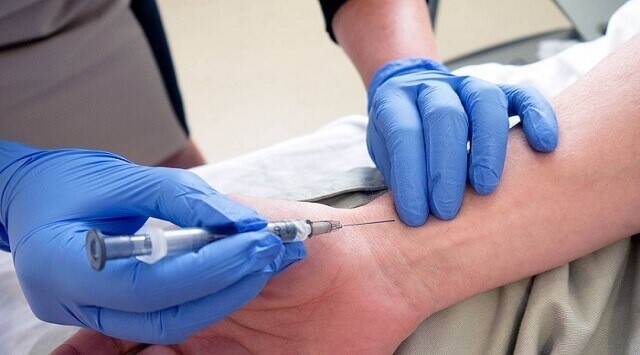
Where is `plunger`? The height and width of the screenshot is (355, 640). plunger is located at coordinates (124, 247).